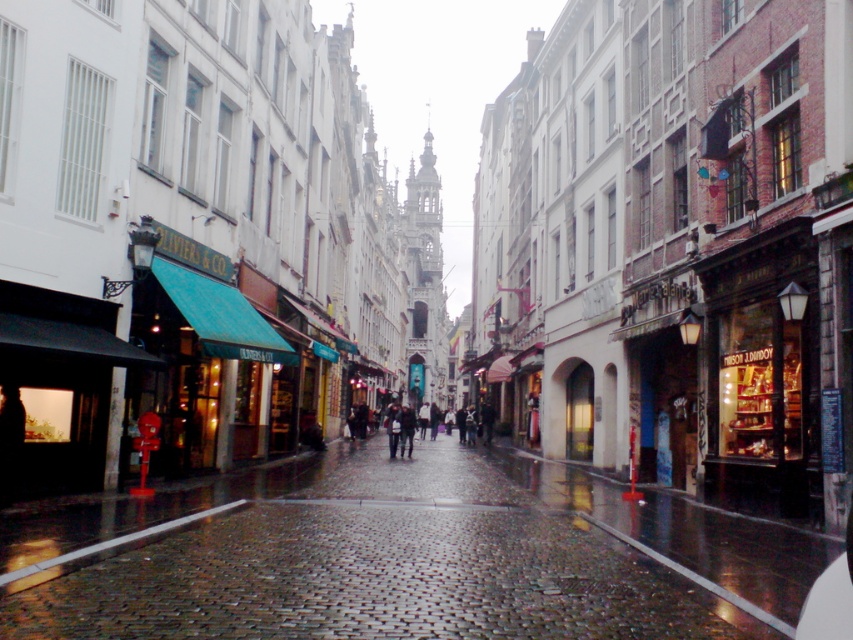
Which of these two, cobblestone pavement at center or dark gray coat at center, stands shorter?

cobblestone pavement at center is shorter.

Between point (534, 532) and point (392, 440), which one is positioned behind?

Point (392, 440)

Locate an element on the screen. cobblestone pavement at center is located at coordinates (404, 556).